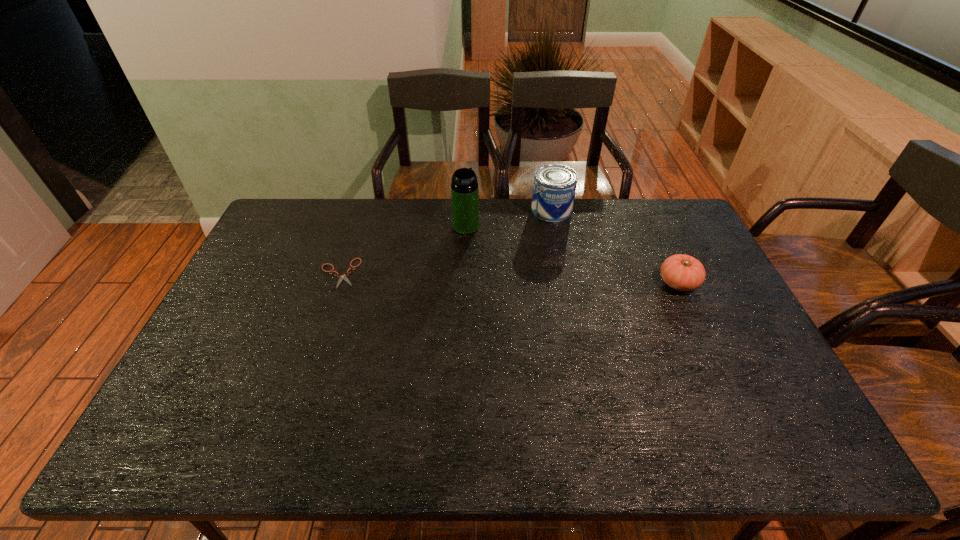
This screenshot has height=540, width=960. What are the coordinates of `free region at the near edge of the desktop` in the screenshot? It's located at (328, 387).

Identify the location of free space at the left edge of the desktop. (241, 295).

You are a GUI agent. You are given a task and a screenshot of the screen. Output one action in this format:
    pyautogui.click(x=<x>, y=<y>)
    Task: Click on the vacant area at the right edge
    Image resolution: width=960 pixels, height=540 pixels.
    Given the screenshot: What is the action you would take?
    [x=742, y=340]

You are a GUI agent. You are given a task and a screenshot of the screen. Output one action in this format:
    pyautogui.click(x=<x>, y=<y>)
    Task: Click on the free region at the far left corner of the desktop
    Image resolution: width=960 pixels, height=540 pixels.
    Given the screenshot: What is the action you would take?
    pyautogui.click(x=298, y=203)

You are a GUI agent. You are given a task and a screenshot of the screen. Output one action in this format:
    pyautogui.click(x=<x>, y=<y>)
    Task: Click on the vacant space in between the second shortest object and the tallest object
    This screenshot has height=540, width=960.
    Given the screenshot: What is the action you would take?
    pyautogui.click(x=572, y=255)

Find the location of `free space between the second object from right to left and the tomato`. free space between the second object from right to left and the tomato is located at coordinates (614, 246).

Identify the location of vacant area between the leftmost object and the tomato. The height and width of the screenshot is (540, 960). (509, 278).

Locate an element on the screen. The image size is (960, 540). empty space that is in between the tallest object and the rightmost object is located at coordinates (572, 255).

Where is `free space between the shears and the second object from right to left`? This screenshot has width=960, height=540. free space between the shears and the second object from right to left is located at coordinates (445, 241).

This screenshot has height=540, width=960. What are the coordinates of `unoccupied area between the tallest object and the shears` in the screenshot? It's located at (402, 250).